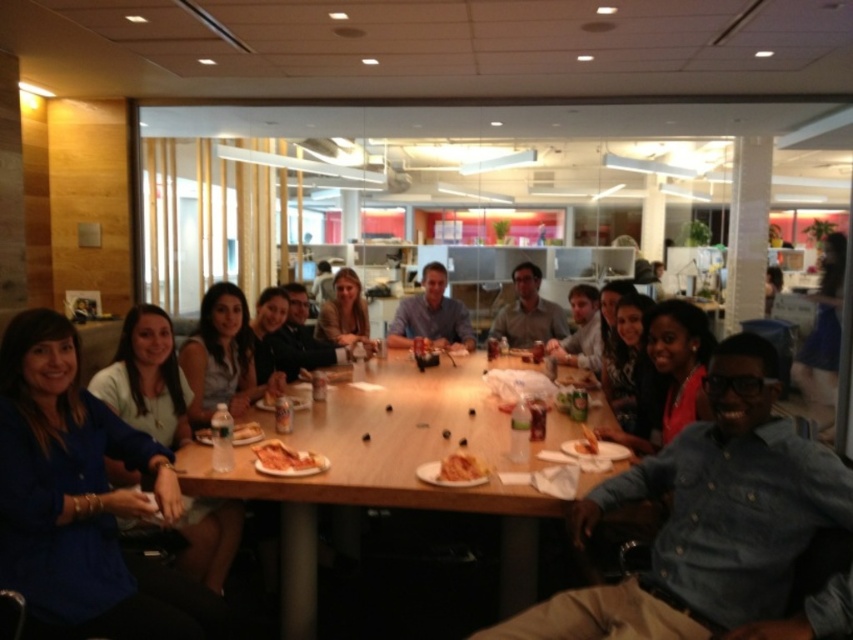
Which is more to the right, blue shirt at center or white paper plate at center?

blue shirt at center is more to the right.

Is point (421, 310) farther from camera compared to point (253, 438)?

That is True.

What are the coordinates of `blue shirt at center` in the screenshot? It's located at (431, 316).

What do you see at coordinates (392, 472) in the screenshot?
I see `wooden table at center` at bounding box center [392, 472].

Can you confirm if wooden table at center is positioned above blue shirt at center?

Incorrect, wooden table at center is not positioned above blue shirt at center.

The width and height of the screenshot is (853, 640). I want to click on wooden table at center, so click(x=392, y=472).

The width and height of the screenshot is (853, 640). Identify the location of wooden table at center. (392, 472).

The height and width of the screenshot is (640, 853). What do you see at coordinates (286, 460) in the screenshot?
I see `golden crispy pizza at center` at bounding box center [286, 460].

Consider the image. Is golden crispy pizza at center smaller than golden crispy fries at center?

Actually, golden crispy pizza at center might be larger than golden crispy fries at center.

Where is `golden crispy pizza at center`? This screenshot has height=640, width=853. golden crispy pizza at center is located at coordinates (286, 460).